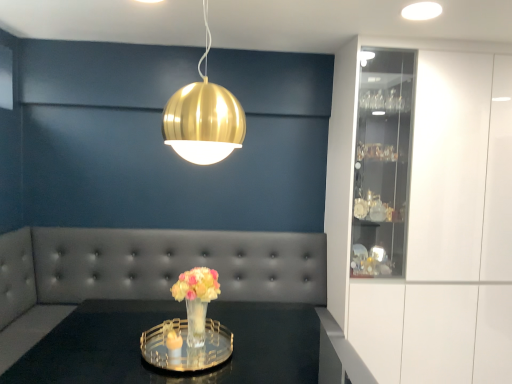
Question: Considering the relative positions of clear glass tray at center and tufted leather couch at center in the image provided, is clear glass tray at center behind tufted leather couch at center?

Choices:
 (A) yes
 (B) no

Answer: (B)

Question: Is tufted leather couch at center completely or partially inside clear glass tray at center?

Choices:
 (A) no
 (B) yes

Answer: (A)

Question: Does clear glass tray at center have a lesser width compared to tufted leather couch at center?

Choices:
 (A) yes
 (B) no

Answer: (B)

Question: From a real-world perspective, is clear glass tray at center positioned under tufted leather couch at center based on gravity?

Choices:
 (A) yes
 (B) no

Answer: (A)

Question: Does clear glass tray at center touch tufted leather couch at center?

Choices:
 (A) no
 (B) yes

Answer: (A)

Question: Do you think gold metallic sphere at upper center is within clear glass tray at center, or outside of it?

Choices:
 (A) outside
 (B) inside

Answer: (A)

Question: From the image's perspective, is gold metallic sphere at upper center positioned above or below clear glass tray at center?

Choices:
 (A) above
 (B) below

Answer: (A)

Question: Is gold metallic sphere at upper center in front of or behind clear glass tray at center in the image?

Choices:
 (A) behind
 (B) front

Answer: (A)

Question: From a real-world perspective, relative to clear glass tray at center, is gold metallic sphere at upper center vertically above or below?

Choices:
 (A) above
 (B) below

Answer: (A)

Question: From a real-world perspective, relative to translucent glass vase at center, is gold metallic sphere at upper center vertically above or below?

Choices:
 (A) below
 (B) above

Answer: (B)

Question: Is gold metallic sphere at upper center inside or outside of translucent glass vase at center?

Choices:
 (A) inside
 (B) outside

Answer: (B)

Question: From their relative heights in the image, would you say gold metallic sphere at upper center is taller or shorter than translucent glass vase at center?

Choices:
 (A) short
 (B) tall

Answer: (B)

Question: From the image's perspective, is gold metallic sphere at upper center above or below translucent glass vase at center?

Choices:
 (A) below
 (B) above

Answer: (B)

Question: Considering the positions of translucent glass vase at center and clear glass tray at center in the image, is translucent glass vase at center taller or shorter than clear glass tray at center?

Choices:
 (A) tall
 (B) short

Answer: (B)

Question: Considering the positions of point (197, 274) and point (94, 380), is point (197, 274) closer or farther from the camera than point (94, 380)?

Choices:
 (A) closer
 (B) farther

Answer: (B)